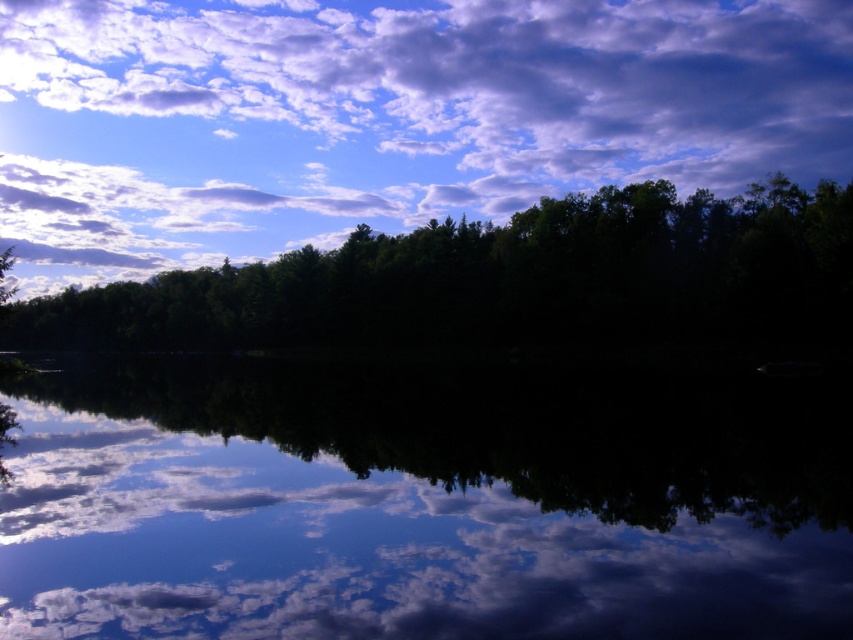
Does point (538, 570) come behind point (277, 186)?

No.

Which is behind, point (563, 563) or point (323, 113)?

Positioned behind is point (323, 113).

The image size is (853, 640). I want to click on transparent glass water at center, so click(x=422, y=502).

Between white fluffy cloud at upper center and green matte forest at center, which one appears on the left side from the viewer's perspective?

green matte forest at center

Is point (462, 17) closer to camera compared to point (381, 324)?

That is False.

Is point (9, 45) positioned before point (772, 189)?

No.

Locate an element on the screen. white fluffy cloud at upper center is located at coordinates (386, 116).

Which is in front, point (505, 547) or point (677, 323)?

Point (505, 547) is in front.

Who is positioned more to the left, transparent glass water at center or green matte forest at center?

Positioned to the left is green matte forest at center.

Does point (230, 365) come behind point (137, 339)?

No, (230, 365) is in front of (137, 339).

What are the coordinates of `transparent glass water at center` in the screenshot? It's located at (422, 502).